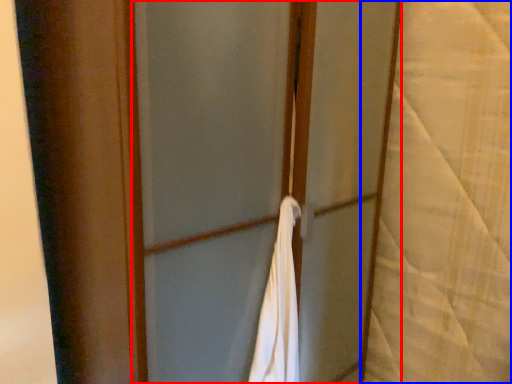
Question: Which object appears farthest to the camera in this image, screen door (highlighted by a red box) or curtain (highlighted by a blue box)?

Choices:
 (A) screen door
 (B) curtain

Answer: (B)